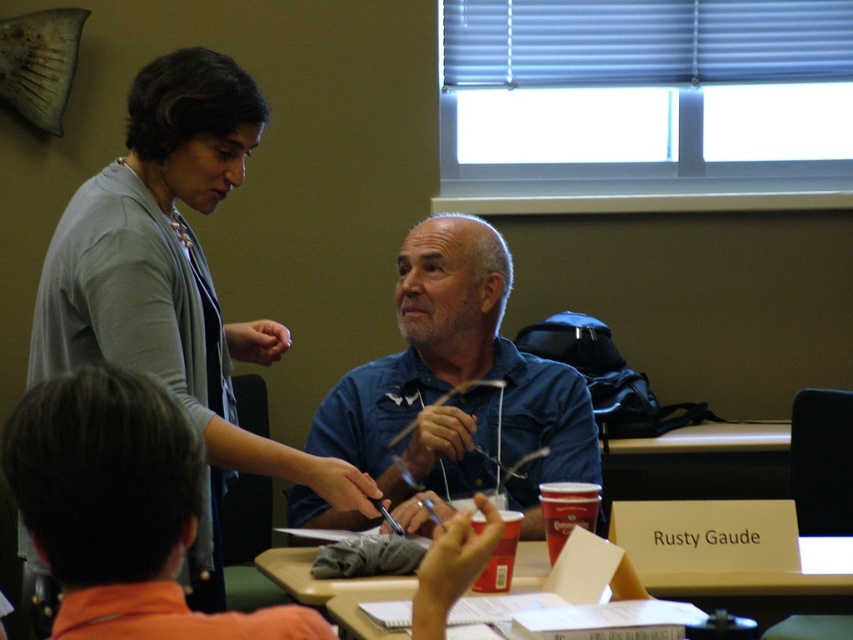
Is gray cardigan at upper left above wooden desk at center?

Yes.

Between gray cardigan at upper left and wooden desk at center, which one appears on the left side from the viewer's perspective?

gray cardigan at upper left

Describe the element at coordinates (173, 285) in the screenshot. This screenshot has width=853, height=640. I see `gray cardigan at upper left` at that location.

Locate an element on the screen. This screenshot has height=640, width=853. gray cardigan at upper left is located at coordinates (173, 285).

Is blue denim shirt at center taller than wooden desk at center?

Yes, blue denim shirt at center is taller than wooden desk at center.

Can you confirm if blue denim shirt at center is positioned below wooden desk at center?

Actually, blue denim shirt at center is above wooden desk at center.

Where is `blue denim shirt at center`? blue denim shirt at center is located at coordinates (457, 385).

Image resolution: width=853 pixels, height=640 pixels. Identify the location of blue denim shirt at center. (457, 385).

Identify the location of gray cardigan at upper left. (173, 285).

Based on the photo, which is more to the right, gray cardigan at upper left or blue denim shirt at center?

blue denim shirt at center

This screenshot has width=853, height=640. Identify the location of gray cardigan at upper left. (173, 285).

You are a GUI agent. You are given a task and a screenshot of the screen. Output one action in this format:
    pyautogui.click(x=<x>, y=<y>)
    Task: Click on the gray cardigan at upper left
    Image resolution: width=853 pixels, height=640 pixels.
    Given the screenshot: What is the action you would take?
    point(173,285)